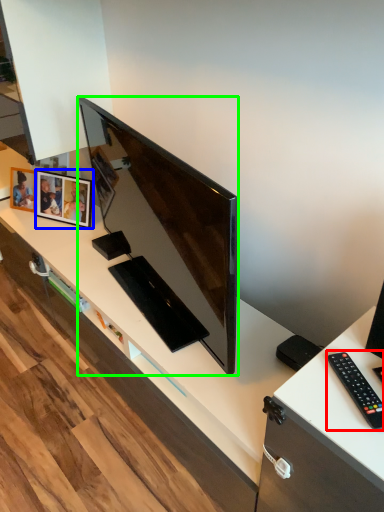
Question: Which object is positioned closest to remote control (highlighted by a red box)? Select from picture frame (highlighted by a blue box) and television (highlighted by a green box).

Choices:
 (A) picture frame
 (B) television

Answer: (B)